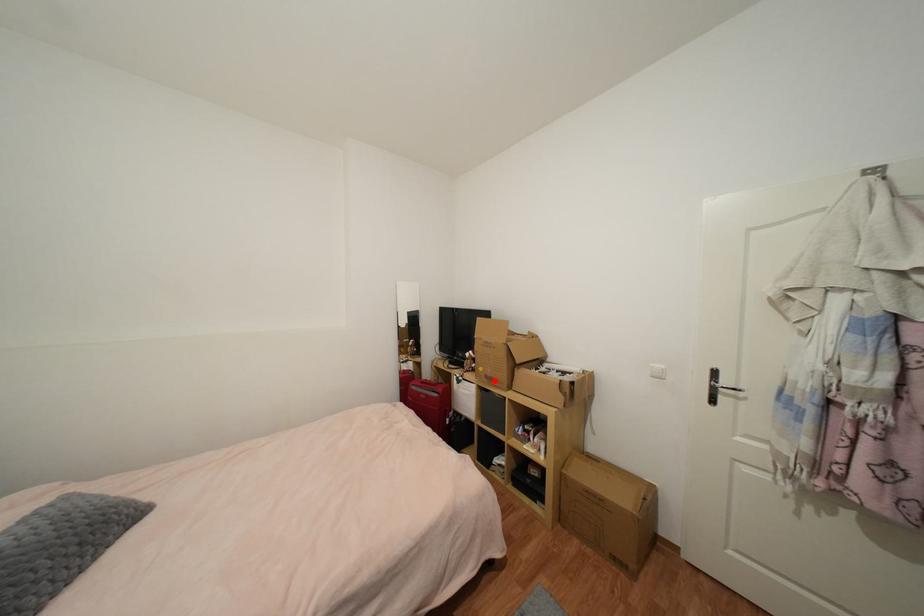
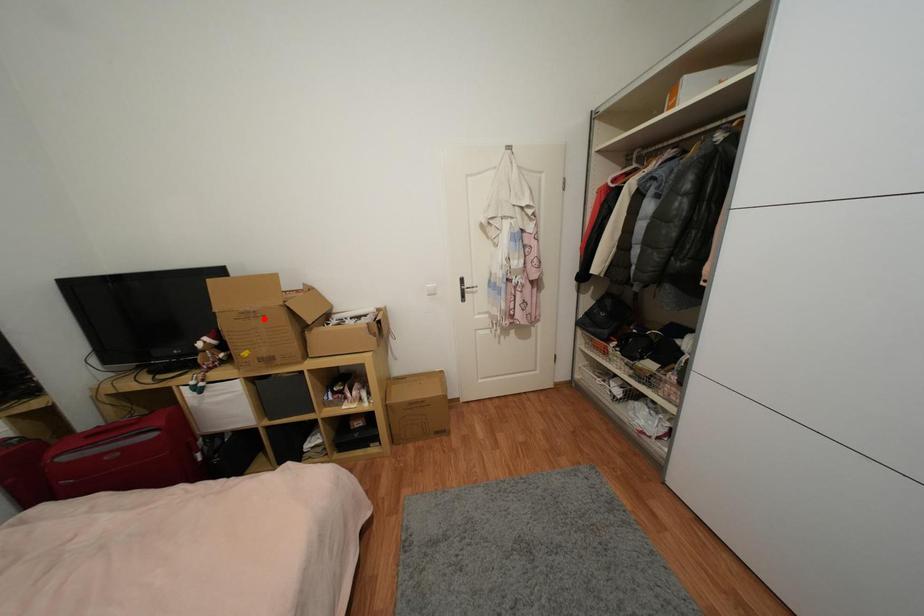
I am providing you with two images of the same scene from different viewpoints. A red point is marked on the first image and another point is marked on the second image. Do the highlighted points in image1 and image2 indicate the same real-world spot?

No